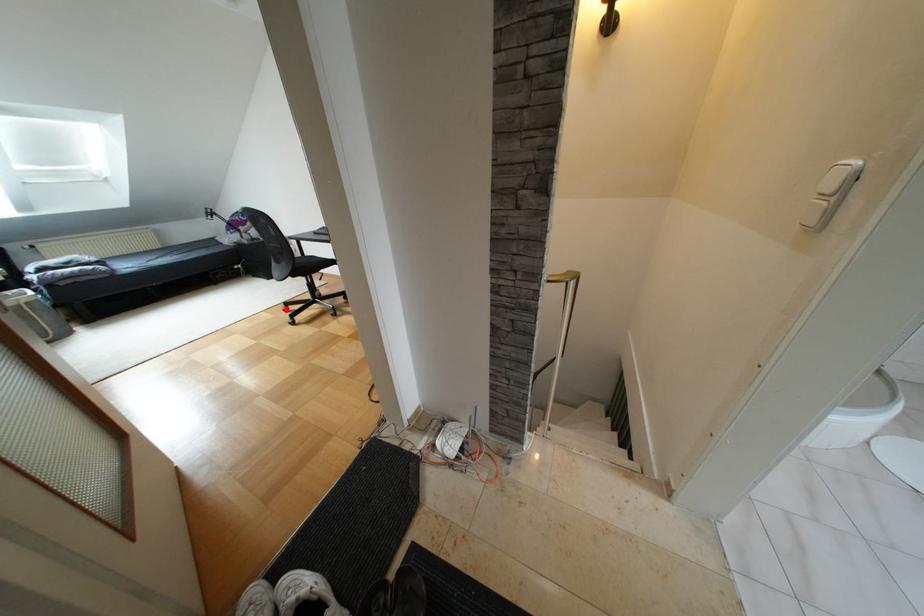
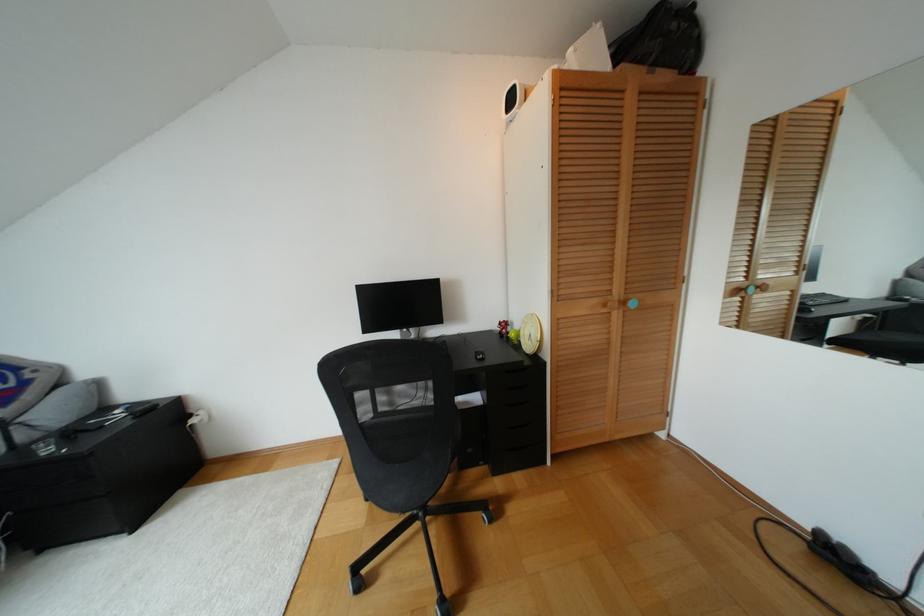
Question: A red point is marked in image1. In image2, is the corresponding 3D point closer to the camera or farther? Reply with the corresponding letter.

Choices:
 (A) The corresponding 3D point is closer.
 (B) The corresponding 3D point is farther.

Answer: (B)